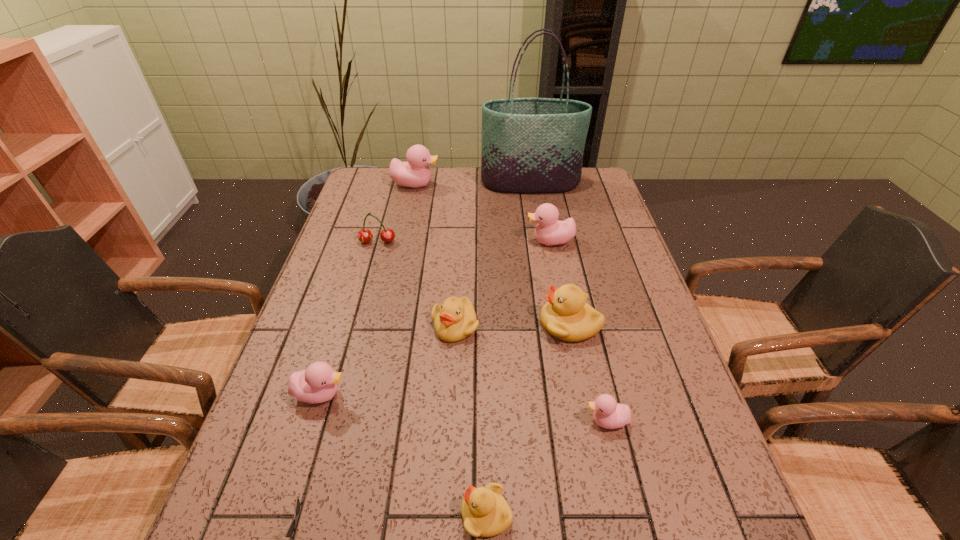
Locate an element on the screen. Image resolution: width=960 pixels, height=540 pixels. tote bag is located at coordinates (529, 145).

The width and height of the screenshot is (960, 540). I want to click on green tote bag, so click(529, 145).

Where is `the farthest pink duckling`? The width and height of the screenshot is (960, 540). the farthest pink duckling is located at coordinates (415, 173).

Where is `the ninth shortest object`? The image size is (960, 540). the ninth shortest object is located at coordinates (415, 173).

Identify the location of the second farthest pink duckling. (549, 231).

Where is `the third smallest pink duckling`? the third smallest pink duckling is located at coordinates (549, 231).

Locate an element on the screen. The image size is (960, 540). the biggest yellow duckling is located at coordinates (566, 316).

Identify the location of red cherry. This screenshot has width=960, height=540. (387, 235).

Find the location of `the third biggest pink duckling`. the third biggest pink duckling is located at coordinates (318, 383).

Locate an element on the screen. Image resolution: width=960 pixels, height=540 pixels. the second smallest yellow duckling is located at coordinates 455,319.